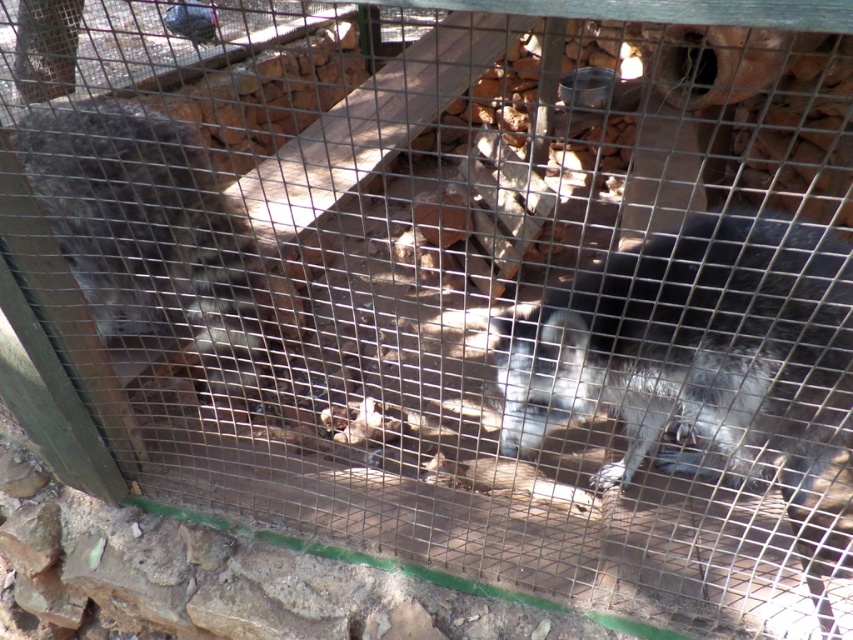
You are standing in front of the enclosure and want to take a photo of both points mentioned. Which point, point [747,438] or point [173,285], will appear larger in your camera view?

Point [747,438] is closer to the viewer than point [173,285], so it will appear larger in the camera view.

You are a zookeeper observing the enclosure. You need to place a food bowl between the gray fur monkey at center and the gray furry animal at left. Based on their positions, where should you place the bowl?

The gray fur monkey at center is to the right of the gray furry animal at left, so you should place the food bowl between them in the middle area between the two animals.